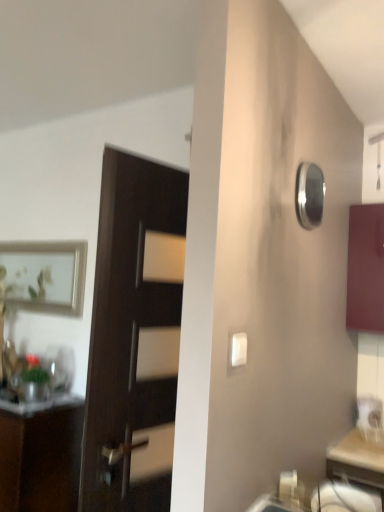
Question: Is matte burgundy cabinet at right, which is the 2th cabinetry in bottom-to-top order, completely or partially inside white plastic light switch at center?

Choices:
 (A) no
 (B) yes

Answer: (A)

Question: Is white plastic light switch at center smaller than matte burgundy cabinet at right, the second cabinetry in the left-to-right sequence?

Choices:
 (A) yes
 (B) no

Answer: (A)

Question: Considering the relative sizes of white plastic light switch at center and matte burgundy cabinet at right, which appears as the 1th cabinetry when viewed from the top, in the image provided, is white plastic light switch at center thinner than matte burgundy cabinet at right, which appears as the 1th cabinetry when viewed from the top,?

Choices:
 (A) no
 (B) yes

Answer: (B)

Question: Could you tell me if white plastic light switch at center is turned towards matte burgundy cabinet at right, which appears as the 1th cabinetry when viewed from the top?

Choices:
 (A) yes
 (B) no

Answer: (B)

Question: From the image's perspective, is white plastic light switch at center over matte burgundy cabinet at right, which appears as the 1th cabinetry when viewed from the top?

Choices:
 (A) yes
 (B) no

Answer: (B)

Question: Relative to matte silver picture frame at upper left, is matte burgundy cabinet at right, the second cabinetry in the left-to-right sequence, in front or behind?

Choices:
 (A) behind
 (B) front

Answer: (B)

Question: In terms of height, does matte burgundy cabinet at right, marked as the first cabinetry in a right-to-left arrangement, look taller or shorter compared to matte silver picture frame at upper left?

Choices:
 (A) tall
 (B) short

Answer: (A)

Question: In the image, is matte burgundy cabinet at right, which is the 2th cabinetry in bottom-to-top order, on the left side or the right side of matte silver picture frame at upper left?

Choices:
 (A) right
 (B) left

Answer: (A)

Question: From the image's perspective, is matte burgundy cabinet at right, the second cabinetry in the left-to-right sequence, above or below matte silver picture frame at upper left?

Choices:
 (A) below
 (B) above

Answer: (B)

Question: In the image, is matte silver picture frame at upper left positioned in front of or behind matte white drawer at lower right?

Choices:
 (A) front
 (B) behind

Answer: (B)

Question: Is matte silver picture frame at upper left situated inside matte white drawer at lower right or outside?

Choices:
 (A) inside
 (B) outside

Answer: (B)

Question: In terms of size, does matte silver picture frame at upper left appear bigger or smaller than matte white drawer at lower right?

Choices:
 (A) small
 (B) big

Answer: (B)

Question: Is matte silver picture frame at upper left taller or shorter than matte white drawer at lower right?

Choices:
 (A) tall
 (B) short

Answer: (A)

Question: Would you say dark wood door at center is inside or outside polished silver mirror at upper right?

Choices:
 (A) outside
 (B) inside

Answer: (A)

Question: Considering the positions of dark wood door at center and polished silver mirror at upper right in the image, is dark wood door at center wider or thinner than polished silver mirror at upper right?

Choices:
 (A) thin
 (B) wide

Answer: (B)